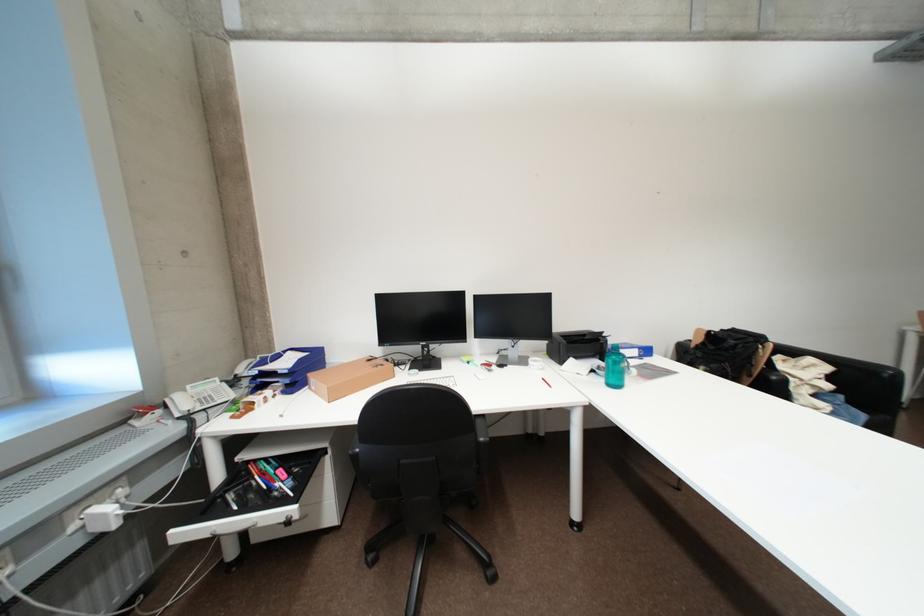
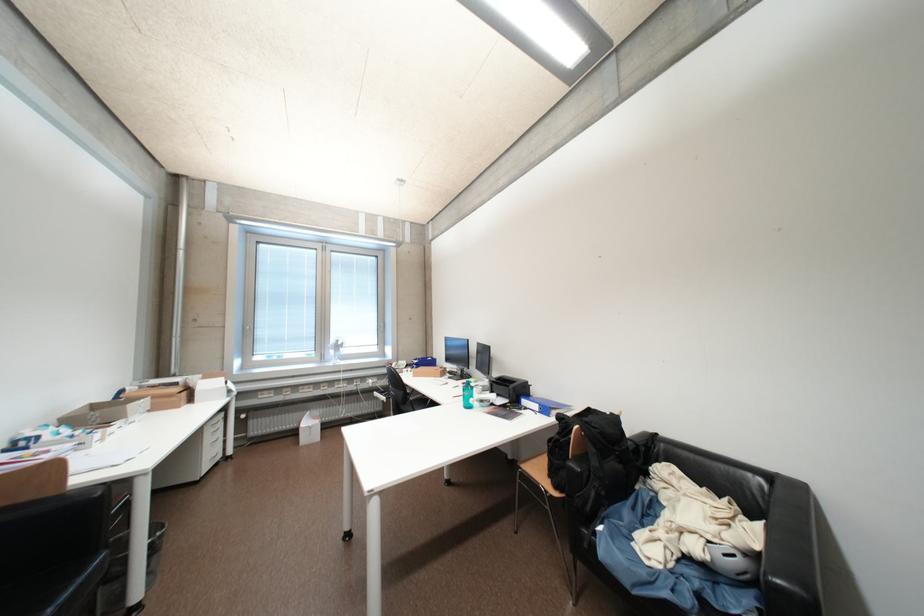
Where in the second image is the point corresponding to pixel 189 535 from the first image?

(383, 395)